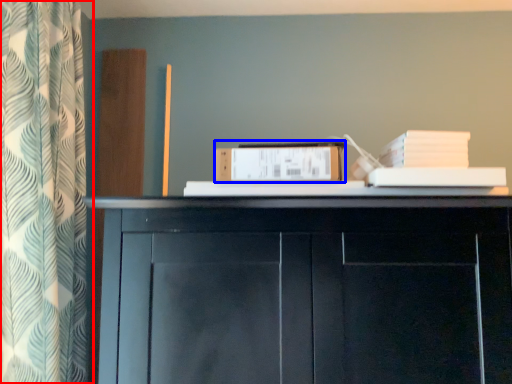
Question: Which object appears farthest to the camera in this image, curtain (highlighted by a red box) or paperback book (highlighted by a blue box)?

Choices:
 (A) curtain
 (B) paperback book

Answer: (B)